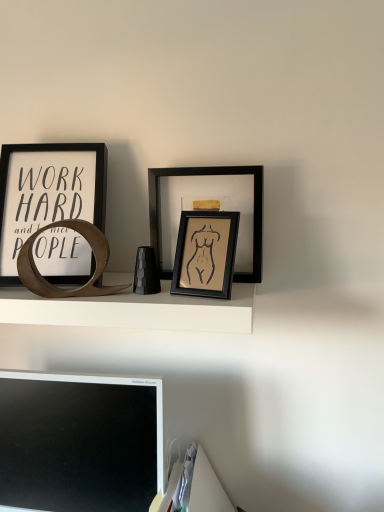
The image size is (384, 512). What do you see at coordinates (79, 442) in the screenshot? I see `black matte computer monitor at lower left` at bounding box center [79, 442].

What do you see at coordinates (207, 198) in the screenshot? This screenshot has height=512, width=384. I see `matte black picture frame at center, acting as the first picture frame starting from the right` at bounding box center [207, 198].

This screenshot has width=384, height=512. What are the coordinates of `matte black picture frame at center, arranged as the second picture frame when viewed from the right` in the screenshot? It's located at (205, 254).

From the picture: Considering the relative sizes of matte black picture frame at center, positioned as the 2th picture frame in left-to-right order, and matte black picture frame at left, the 3th picture frame in the right-to-left sequence, in the image provided, is matte black picture frame at center, positioned as the 2th picture frame in left-to-right order, wider than matte black picture frame at left, the 3th picture frame in the right-to-left sequence,?

No, matte black picture frame at center, positioned as the 2th picture frame in left-to-right order, is not wider than matte black picture frame at left, the 3th picture frame in the right-to-left sequence.

Could you tell me if matte black picture frame at center, positioned as the 2th picture frame in left-to-right order, is turned towards matte black picture frame at left, the 3th picture frame in the right-to-left sequence?

No, matte black picture frame at center, positioned as the 2th picture frame in left-to-right order, does not turn towards matte black picture frame at left, the 3th picture frame in the right-to-left sequence.

From a real-world perspective, which picture frame is the 2nd one underneath the matte black picture frame at left, the 3th picture frame in the right-to-left sequence? Please provide its 2D coordinates.

[(205, 254)]

Are matte black picture frame at center, arranged as the second picture frame when viewed from the right, and matte black picture frame at left, acting as the first picture frame starting from the left, beside each other?

No, matte black picture frame at center, arranged as the second picture frame when viewed from the right, is not next to matte black picture frame at left, acting as the first picture frame starting from the left.

Is there a large distance between matte black picture frame at left, the 3th picture frame in the right-to-left sequence, and matte black picture frame at center, arranged as the second picture frame when viewed from the right?

No, there isn't a large distance between matte black picture frame at left, the 3th picture frame in the right-to-left sequence, and matte black picture frame at center, arranged as the second picture frame when viewed from the right.

Is point (32, 173) positioned after point (205, 223)?

Yes, it is behind point (205, 223).

Is matte black picture frame at left, acting as the first picture frame starting from the left, looking in the opposite direction of matte black picture frame at center, arranged as the second picture frame when viewed from the right?

No.

Visually, is matte black picture frame at left, acting as the first picture frame starting from the left, positioned to the left or to the right of matte black picture frame at center, arranged as the second picture frame when viewed from the right?

Based on their positions, matte black picture frame at left, acting as the first picture frame starting from the left, is located to the left of matte black picture frame at center, arranged as the second picture frame when viewed from the right.

In the scene shown: Which object is further away from the camera, black matte computer monitor at lower left or matte black picture frame at center, acting as the first picture frame starting from the right?

matte black picture frame at center, acting as the first picture frame starting from the right, is more distant.

From a real-world perspective, is black matte computer monitor at lower left above or below matte black picture frame at center, which ranks as the 3th picture frame in left-to-right order?

From a real-world perspective, black matte computer monitor at lower left is physically below matte black picture frame at center, which ranks as the 3th picture frame in left-to-right order.

Is there a large distance between black matte computer monitor at lower left and matte black picture frame at center, which ranks as the 3th picture frame in left-to-right order?

That's not correct — black matte computer monitor at lower left is a little close to matte black picture frame at center, which ranks as the 3th picture frame in left-to-right order.

Can you tell me how much black matte computer monitor at lower left and matte black picture frame at center, acting as the first picture frame starting from the right, differ in facing direction?

There is a 0.966-degree angle between the facing directions of black matte computer monitor at lower left and matte black picture frame at center, acting as the first picture frame starting from the right.

Which of these two, matte black picture frame at left, acting as the first picture frame starting from the left, or white matte shelf at center, is wider?

With larger width is white matte shelf at center.

Is matte black picture frame at left, acting as the first picture frame starting from the left, placed right next to white matte shelf at center?

No, matte black picture frame at left, acting as the first picture frame starting from the left, is not touching white matte shelf at center.

Considering their positions, is matte black picture frame at left, the 3th picture frame in the right-to-left sequence, located in front of or behind white matte shelf at center?

matte black picture frame at left, the 3th picture frame in the right-to-left sequence, is positioned farther from the viewer than white matte shelf at center.

Consider the image. Based on their sizes in the image, would you say matte black picture frame at left, the 3th picture frame in the right-to-left sequence, is bigger or smaller than white matte shelf at center?

Considering their sizes, matte black picture frame at left, the 3th picture frame in the right-to-left sequence, takes up less space than white matte shelf at center.

Is white matte shelf at center not close to matte black picture frame at center, arranged as the second picture frame when viewed from the right?

No.

Is white matte shelf at center positioned beyond the bounds of matte black picture frame at center, positioned as the 2th picture frame in left-to-right order?

Yes.

Based on the photo, from a real-world perspective, is white matte shelf at center positioned above or below matte black picture frame at center, positioned as the 2th picture frame in left-to-right order?

white matte shelf at center is below matte black picture frame at center, positioned as the 2th picture frame in left-to-right order.

From the picture: From the image's perspective, which object appears higher, white matte shelf at center or matte black picture frame at center, positioned as the 2th picture frame in left-to-right order?

matte black picture frame at center, positioned as the 2th picture frame in left-to-right order, appears higher in the image.

From a real-world perspective, is matte black picture frame at center, arranged as the second picture frame when viewed from the right, beneath black matte computer monitor at lower left?

No, from a real-world perspective, matte black picture frame at center, arranged as the second picture frame when viewed from the right, is not under black matte computer monitor at lower left.

Can you tell me how much matte black picture frame at center, arranged as the second picture frame when viewed from the right, and black matte computer monitor at lower left differ in facing direction?

They differ by 8.63 degrees in their facing directions.

Considering the sizes of matte black picture frame at center, positioned as the 2th picture frame in left-to-right order, and black matte computer monitor at lower left in the image, is matte black picture frame at center, positioned as the 2th picture frame in left-to-right order, taller or shorter than black matte computer monitor at lower left?

Clearly, matte black picture frame at center, positioned as the 2th picture frame in left-to-right order, is shorter compared to black matte computer monitor at lower left.

Is matte black picture frame at center, arranged as the second picture frame when viewed from the right, facing towards black matte computer monitor at lower left?

No.

Which is more to the right, black matte computer monitor at lower left or matte black picture frame at left, the 3th picture frame in the right-to-left sequence?

black matte computer monitor at lower left.

From a real-world perspective, who is located higher, black matte computer monitor at lower left or matte black picture frame at left, the 3th picture frame in the right-to-left sequence?

matte black picture frame at left, the 3th picture frame in the right-to-left sequence, from a real-world perspective.

Is black matte computer monitor at lower left far away from matte black picture frame at left, acting as the first picture frame starting from the left?

No, black matte computer monitor at lower left is not far away from matte black picture frame at left, acting as the first picture frame starting from the left.

Is black matte computer monitor at lower left smaller than matte black picture frame at left, acting as the first picture frame starting from the left?

No, black matte computer monitor at lower left is not smaller than matte black picture frame at left, acting as the first picture frame starting from the left.

From the image's perspective, which picture frame is the 2nd one above the matte black picture frame at center, arranged as the second picture frame when viewed from the right? Please provide its 2D coordinates.

[(47, 192)]

Locate an element on the screen. This screenshot has height=512, width=384. the 1st picture frame behind the matte black picture frame at center, positioned as the 2th picture frame in left-to-right order is located at coordinates (47, 192).

From the image, which object appears to be nearer to matte black picture frame at left, acting as the first picture frame starting from the left, matte black picture frame at center, arranged as the second picture frame when viewed from the right, or white matte shelf at center?

white matte shelf at center.

Based on their spatial positions, is matte black picture frame at center, arranged as the second picture frame when viewed from the right, or black matte computer monitor at lower left further from matte black picture frame at center, acting as the first picture frame starting from the right?

black matte computer monitor at lower left lies further to matte black picture frame at center, acting as the first picture frame starting from the right, than the other object.

Looking at the image, which one is located closer to matte black picture frame at center, acting as the first picture frame starting from the right, matte black picture frame at left, acting as the first picture frame starting from the left, or white matte shelf at center?

white matte shelf at center is positioned closer to the anchor matte black picture frame at center, acting as the first picture frame starting from the right.

Considering their positions, is matte black picture frame at center, acting as the first picture frame starting from the right, positioned closer to matte black picture frame at left, acting as the first picture frame starting from the left, than black matte computer monitor at lower left?

Based on the image, matte black picture frame at center, acting as the first picture frame starting from the right, appears to be nearer to matte black picture frame at left, acting as the first picture frame starting from the left.

When comparing their distances from matte black picture frame at center, positioned as the 2th picture frame in left-to-right order, does white matte shelf at center or black matte computer monitor at lower left seem closer?

white matte shelf at center.

Estimate the real-world distances between objects in this image. Which object is closer to matte black picture frame at left, the 3th picture frame in the right-to-left sequence, white matte shelf at center or matte black picture frame at center, arranged as the second picture frame when viewed from the right?

white matte shelf at center.

Considering their positions, is white matte shelf at center positioned further to matte black picture frame at center, acting as the first picture frame starting from the right, than matte black picture frame at center, arranged as the second picture frame when viewed from the right?

white matte shelf at center.

Estimate the real-world distances between objects in this image. Which object is further from white matte shelf at center, matte black picture frame at center, positioned as the 2th picture frame in left-to-right order, or black matte computer monitor at lower left?

black matte computer monitor at lower left is positioned further to the anchor white matte shelf at center.

Find the location of `picture frame between matte black picture frame at center, which ranks as the 3th picture frame in left-to-right order, and black matte computer monitor at lower left vertically`. picture frame between matte black picture frame at center, which ranks as the 3th picture frame in left-to-right order, and black matte computer monitor at lower left vertically is located at coordinates (205, 254).

At what (x,y) coordinates should I click in order to perform the action: click on shelf situated between matte black picture frame at left, acting as the first picture frame starting from the left, and matte black picture frame at center, positioned as the 2th picture frame in left-to-right order, from left to right. Please return your answer as a coordinate pair (x, y). Looking at the image, I should click on (133, 310).

I want to click on shelf between matte black picture frame at center, which ranks as the 3th picture frame in left-to-right order, and black matte computer monitor at lower left, in the vertical direction, so click(x=133, y=310).

At what (x,y) coordinates should I click in order to perform the action: click on picture frame between white matte shelf at center and matte black picture frame at center, which ranks as the 3th picture frame in left-to-right order, in the horizontal direction. Please return your answer as a coordinate pair (x, y). The image size is (384, 512). Looking at the image, I should click on (205, 254).